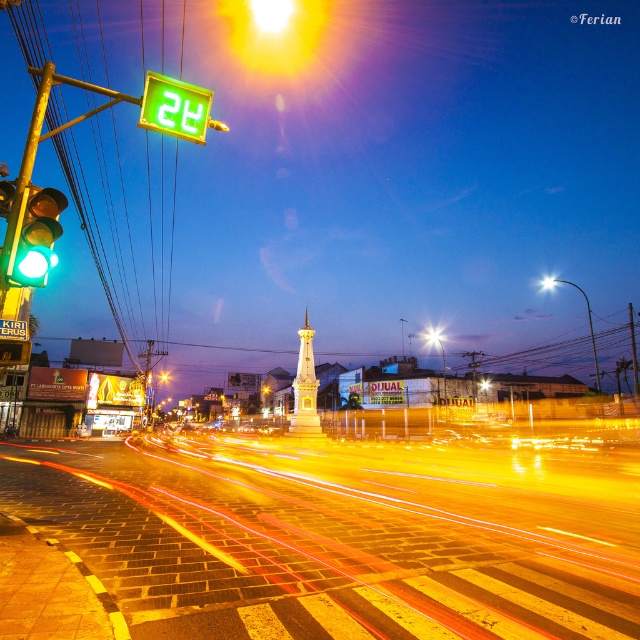
Question: Does yellow brick road at center have a smaller size compared to white glossy street light at center?

Choices:
 (A) no
 (B) yes

Answer: (B)

Question: Which object appears farthest from the camera in this image?

Choices:
 (A) white glossy street light at upper center
 (B) metallic tower at center
 (C) white glossy street light at center

Answer: (B)

Question: Does yellow brick road at center come in front of green matte traffic light at left?

Choices:
 (A) yes
 (B) no

Answer: (B)

Question: Which object is closer to the camera taking this photo?

Choices:
 (A) white glossy street light at upper center
 (B) metallic tower at center
 (C) metallic street light at center
 (D) yellow glass street light at upper center

Answer: (A)

Question: Among these objects, which one is farthest from the camera?

Choices:
 (A) green plastic sign at upper left
 (B) metallic tower at center
 (C) green matte traffic light at left
 (D) white glossy street light at upper center

Answer: (B)

Question: Is white glossy street light at upper center above metallic tower at center?

Choices:
 (A) no
 (B) yes

Answer: (B)